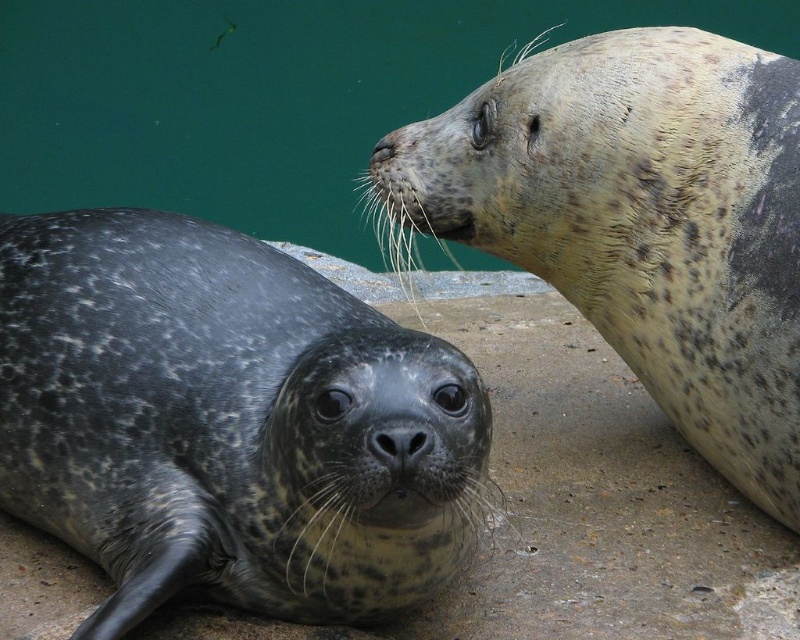
You are a wildlife photographer aiming to capture both the spotted fur seal at lower left and the matte gray seal at upper center in a single frame. Based on their positions, which seal will appear smaller in the photo?

The spotted fur seal at lower left will appear smaller in the photo because it is not as tall as the matte gray seal at upper center.

You are a zookeeper observing the seals. You notice the matte gray seal at upper center and the black matte nose at center. Which object is closer to you?

The matte gray seal at upper center is closer to you because it is positioned over the black matte nose at center, indicating it is in front.

You are a photographer standing in front of the two seals. You want to take a photo that includes both seals clearly. Which point, point [254,200] or point [426,433], is closer to you and should be focused on first to ensure both are in focus?

Point [254,200] is closer to you than point [426,433]. To ensure both seals are in focus, focus on the closer point first, which is point [254,200].